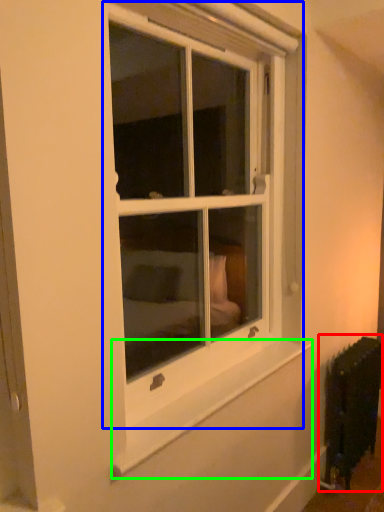
Question: Based on their relative distances, which object is nearer to radiator (highlighted by a red box)? Choose from window (highlighted by a blue box) and window sill (highlighted by a green box).

Choices:
 (A) window
 (B) window sill

Answer: (B)